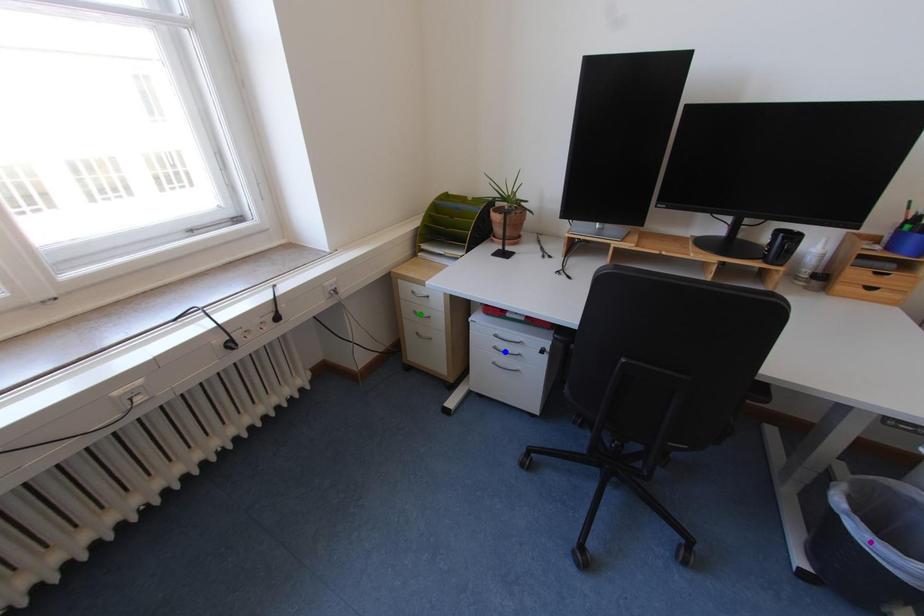
Order these from farthest to nearest:
purple point
blue point
green point

1. green point
2. blue point
3. purple point